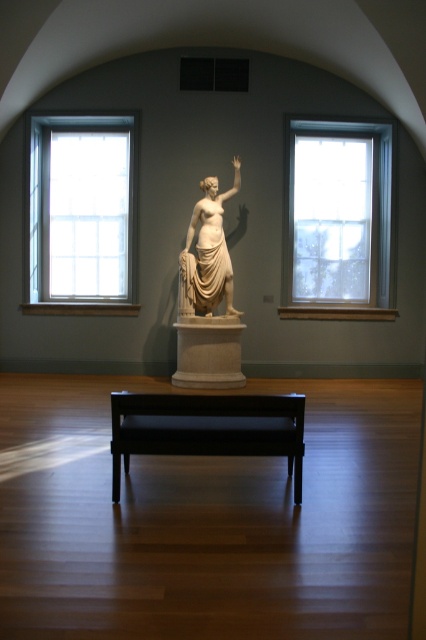
You are a visitor in the museum and want to sit down to admire the sculpture. Is the black wood bench at center located directly below the white marble pedestal at center where the sculpture is placed?

Yes, the black wood bench at center is positioned under the white marble pedestal at center, so it is directly below the sculpture.

You are an art conservator tasked with ensuring the sculpture on the white marble pedestal at center is protected from direct sunlight. Based on the scene, is the clear glass window at left positioned in a way that sunlight coming through it could directly hit the pedestal?

The clear glass window at left is above the white marble pedestal at center, so sunlight coming through the clear glass window at left could directly hit the pedestal.